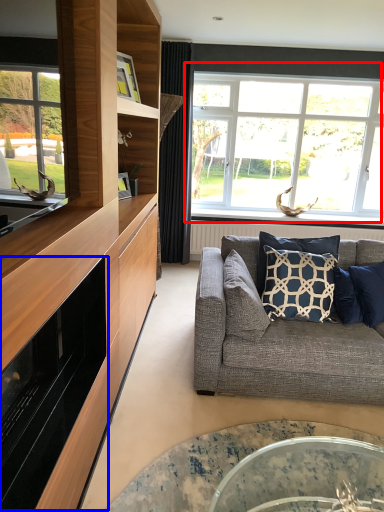
Question: Which object is closer to the camera taking this photo, window (highlighted by a red box) or appliance (highlighted by a blue box)?

Choices:
 (A) window
 (B) appliance

Answer: (B)